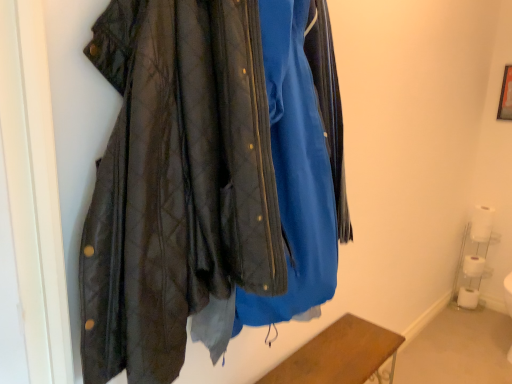
Question: From the image's perspective, is white matte toilet paper at lower right, which is the second toilet paper in bottom-to-top order, under white matte toilet paper at lower right, positioned as the 1th toilet paper in bottom-to-top order?

Choices:
 (A) no
 (B) yes

Answer: (A)

Question: Is white matte toilet paper at lower right, which is counted as the 3th toilet paper, starting from the top, further to camera compared to white matte toilet paper at lower right, positioned as the 1th toilet paper in bottom-to-top order?

Choices:
 (A) no
 (B) yes

Answer: (A)

Question: Considering the relative sizes of white matte toilet paper at lower right, which is counted as the 3th toilet paper, starting from the top, and white matte toilet paper at lower right, positioned as the 1th toilet paper in bottom-to-top order, in the image provided, is white matte toilet paper at lower right, which is counted as the 3th toilet paper, starting from the top, smaller than white matte toilet paper at lower right, positioned as the 1th toilet paper in bottom-to-top order,?

Choices:
 (A) yes
 (B) no

Answer: (B)

Question: Can you confirm if white matte toilet paper at lower right, which is the second toilet paper in bottom-to-top order, is thinner than white matte toilet paper at lower right, positioned as the 1th toilet paper in bottom-to-top order?

Choices:
 (A) yes
 (B) no

Answer: (B)

Question: Is white matte toilet paper at lower right, which is counted as the 3th toilet paper, starting from the top, oriented towards white matte toilet paper at lower right, positioned as the 1th toilet paper in bottom-to-top order?

Choices:
 (A) yes
 (B) no

Answer: (B)

Question: From a real-world perspective, is white matte toilet paper at lower right, which is the second toilet paper in bottom-to-top order, positioned above or below white matte toilet paper at lower right, which appears as the 1th toilet paper when viewed from the top?

Choices:
 (A) below
 (B) above

Answer: (A)

Question: Is white matte toilet paper at lower right, which is the second toilet paper in bottom-to-top order, bigger or smaller than white matte toilet paper at lower right, the fourth toilet paper positioned from the bottom?

Choices:
 (A) small
 (B) big

Answer: (B)

Question: Is white matte toilet paper at lower right, which is counted as the 3th toilet paper, starting from the top, spatially inside white matte toilet paper at lower right, the fourth toilet paper positioned from the bottom, or outside of it?

Choices:
 (A) outside
 (B) inside

Answer: (A)

Question: Looking at their shapes, would you say white matte toilet paper at lower right, which is the second toilet paper in bottom-to-top order, is wider or thinner than white matte toilet paper at lower right, which appears as the 1th toilet paper when viewed from the top?

Choices:
 (A) wide
 (B) thin

Answer: (A)

Question: In terms of width, does wooden frame at upper right look wider or thinner when compared to white matte toilet paper at lower right, which appears as the 1th toilet paper when viewed from the top?

Choices:
 (A) wide
 (B) thin

Answer: (B)

Question: Considering the positions of wooden frame at upper right and white matte toilet paper at lower right, the fourth toilet paper positioned from the bottom, in the image, is wooden frame at upper right taller or shorter than white matte toilet paper at lower right, the fourth toilet paper positioned from the bottom,?

Choices:
 (A) short
 (B) tall

Answer: (B)

Question: Which is correct: wooden frame at upper right is inside white matte toilet paper at lower right, which appears as the 1th toilet paper when viewed from the top, or outside of it?

Choices:
 (A) inside
 (B) outside

Answer: (B)

Question: From the image's perspective, is wooden frame at upper right located above or below white matte toilet paper at lower right, the fourth toilet paper positioned from the bottom?

Choices:
 (A) above
 (B) below

Answer: (A)

Question: In terms of size, does white matte toilet paper at lower right, positioned as the 1th toilet paper in bottom-to-top order, appear bigger or smaller than white plastic shelf at lower right?

Choices:
 (A) big
 (B) small

Answer: (B)

Question: Does point (468, 304) appear closer or farther from the camera than point (467, 236)?

Choices:
 (A) closer
 (B) farther

Answer: (A)